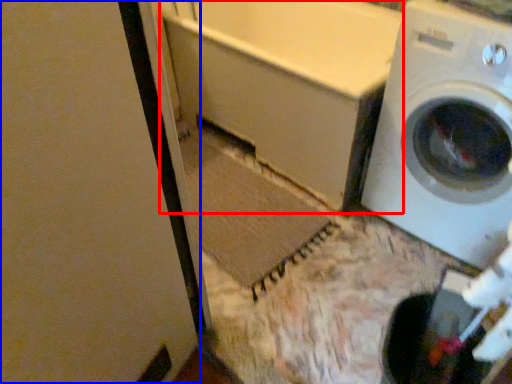
Question: Which point is further to the camera, bath (highlighted by a red box) or screen door (highlighted by a blue box)?

Choices:
 (A) bath
 (B) screen door

Answer: (A)